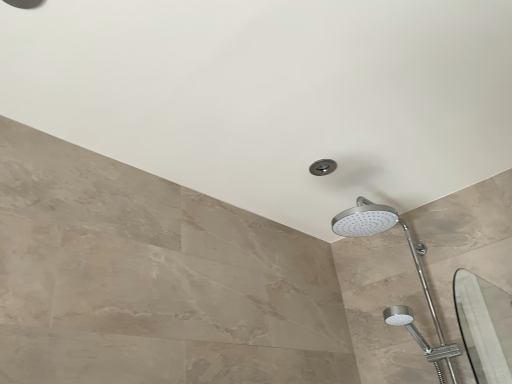
Question: Should I look upward or downward to see silver metallic shower head at upper right?

Choices:
 (A) down
 (B) up

Answer: (A)